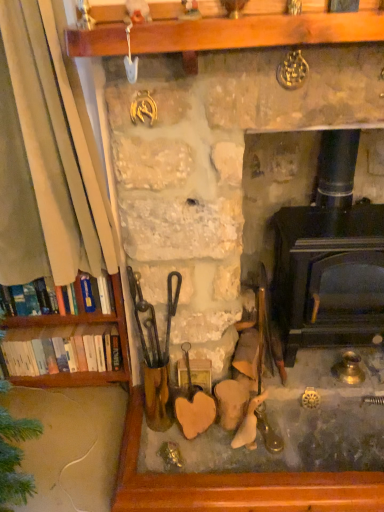
Question: Is white paperbacks at left, which ranks as the second book in top-to-bottom order, wider or thinner than stone fireplace at center?

Choices:
 (A) wide
 (B) thin

Answer: (B)

Question: From the image's perspective, is white paperbacks at left, the 1th book from the bottom, positioned above or below stone fireplace at center?

Choices:
 (A) above
 (B) below

Answer: (B)

Question: Which is farther from the hardcover books at left, placed as the 1th book when sorted from top to bottom?

Choices:
 (A) stone fireplace at center
 (B) black cast iron wood burning stove at center
 (C) white paperbacks at left, the 1th book from the bottom

Answer: (B)

Question: Considering the real-world distances, which object is closest to the stone fireplace at center?

Choices:
 (A) white paperbacks at left, which ranks as the second book in top-to-bottom order
 (B) hardcover books at left, arranged as the 1th book when viewed from the front
 (C) black cast iron wood burning stove at center

Answer: (C)